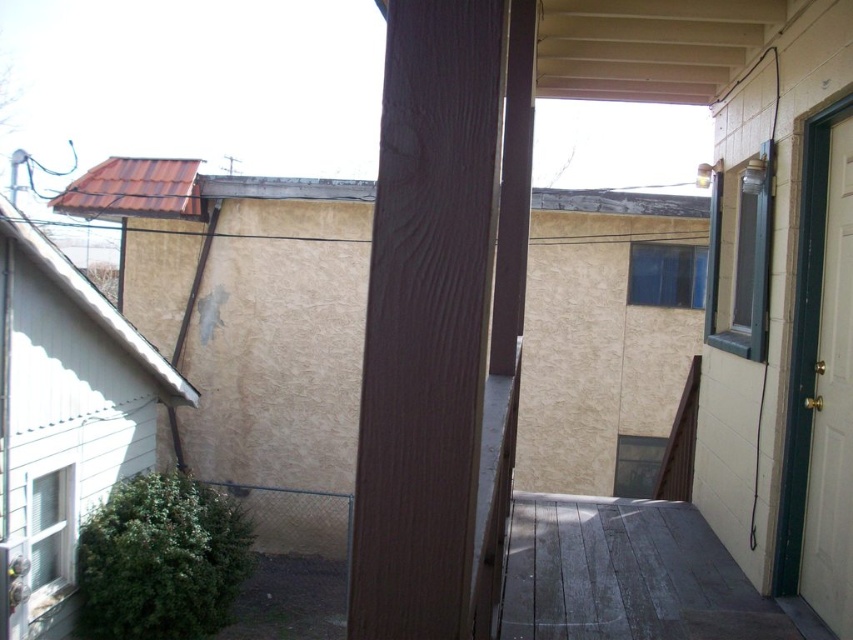
You are standing on the weathered wood deck at lower center and want to enter the house through the white glossy door at right. Since the deck is larger than the door, can you walk around the door to reach it?

The weathered wood deck at lower center has a larger size compared to the white glossy door at right, so yes, you can walk around the door to reach it since the deck provides enough space around the door.

You are a delivery person trying to reach the white glossy door at right from the weathered wood deck at lower center. Can you walk directly to the door without stepping off the deck?

The distance between the weathered wood deck at lower center and the white glossy door at right is 3.47 feet, so yes, you can walk directly to the door without leaving the deck since the deck extends close enough to the door.